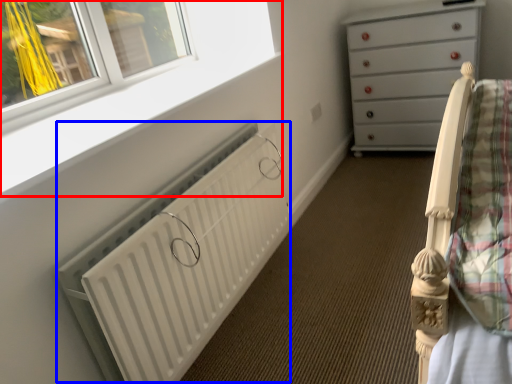
Question: Among these objects, which one is nearest to the camera, window frame (highlighted by a red box) or radiator (highlighted by a blue box)?

Choices:
 (A) window frame
 (B) radiator

Answer: (A)